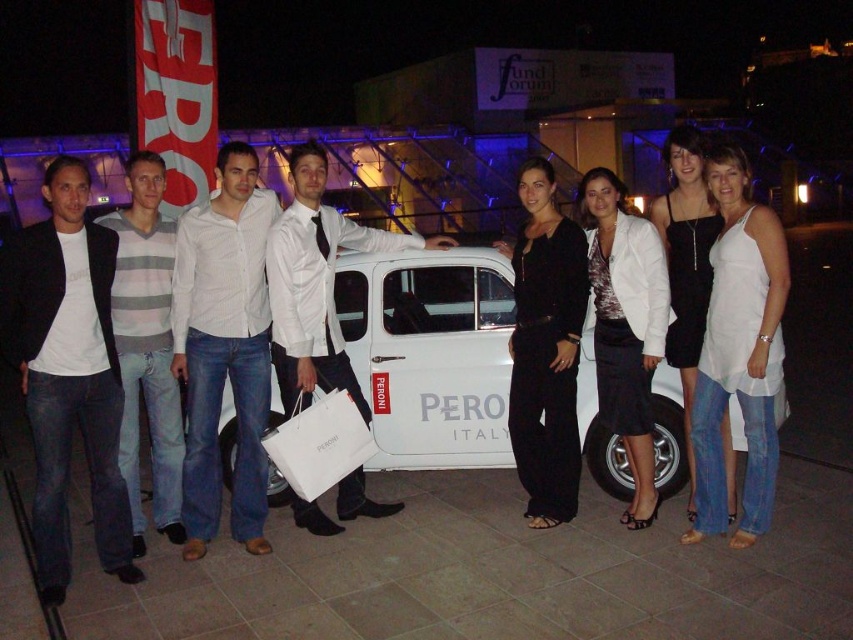
Question: Among these objects, which one is farthest from the camera?

Choices:
 (A) white cotton shirt at center
 (B) black matte pants at center
 (C) black satin dress at center
 (D) white cotton tank top at center

Answer: (B)

Question: Is white cotton shirt at center smaller than white cotton tank top at center?

Choices:
 (A) yes
 (B) no

Answer: (B)

Question: Does white cotton shirt at center have a greater width compared to white glossy shirt at center?

Choices:
 (A) no
 (B) yes

Answer: (A)

Question: Which point appears farthest from the camera in this image?

Choices:
 (A) (640, 442)
 (B) (701, 177)
 (C) (137, 529)

Answer: (C)

Question: Is white matte car at center positioned in front of white cotton shirt at center?

Choices:
 (A) no
 (B) yes

Answer: (A)

Question: Which of these objects is positioned closest to the gray striped sweater at left?

Choices:
 (A) white cotton tank top at center
 (B) white glossy shirt at center
 (C) white cotton shirt at center

Answer: (C)